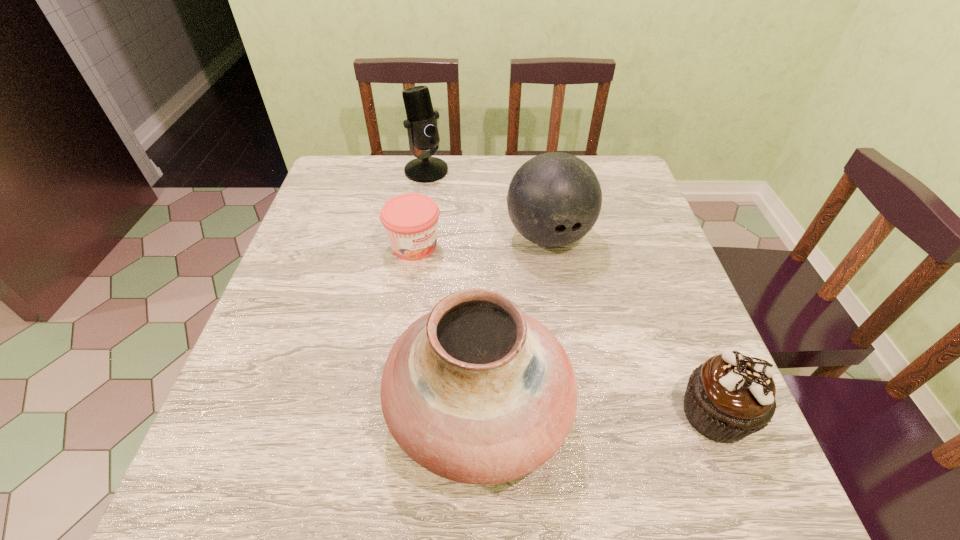
The width and height of the screenshot is (960, 540). I want to click on vacant space located on the front label of the jam, so click(x=464, y=288).

The width and height of the screenshot is (960, 540). I want to click on free space located 0.140m on the stand of the microphone, so click(450, 209).

You are a GUI agent. You are given a task and a screenshot of the screen. Output one action in this format:
    pyautogui.click(x=<x>, y=<y>)
    Task: Click on the free space located on the stand of the microphone
    The width and height of the screenshot is (960, 540).
    Given the screenshot: What is the action you would take?
    pyautogui.click(x=478, y=253)

The height and width of the screenshot is (540, 960). Identify the location of free space located 0.140m on the stand of the microphone. coord(450,209).

Locate an element on the screen. The height and width of the screenshot is (540, 960). vacant space located 0.370m on the grip area of the bowling ball is located at coordinates (631, 408).

Where is `free location located 0.390m on the grip area of the bowling ball`? free location located 0.390m on the grip area of the bowling ball is located at coordinates point(636,418).

Where is `vacant area located 0.180m on the grip area of the bowling ball`? vacant area located 0.180m on the grip area of the bowling ball is located at coordinates (591, 325).

You are a GUI agent. You are given a task and a screenshot of the screen. Output one action in this format:
    pyautogui.click(x=<x>, y=<y>)
    Task: Click on the object located at the far edge
    
    Given the screenshot: What is the action you would take?
    pyautogui.click(x=421, y=124)

This screenshot has height=540, width=960. In order to click on pottery that is at the near edge in this screenshot , I will do `click(476, 391)`.

Where is `cupcake that is at the near edge`? cupcake that is at the near edge is located at coordinates (730, 396).